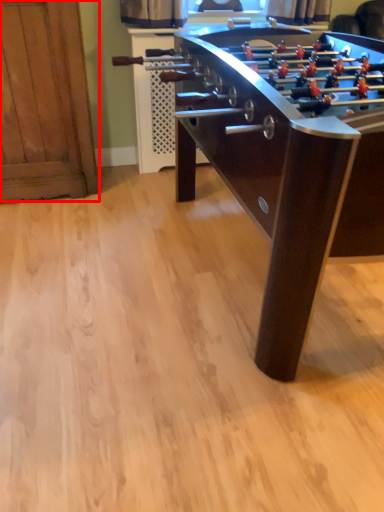
Question: Where is furniture (annotated by the red box) located in relation to table in the image?

Choices:
 (A) right
 (B) left

Answer: (B)